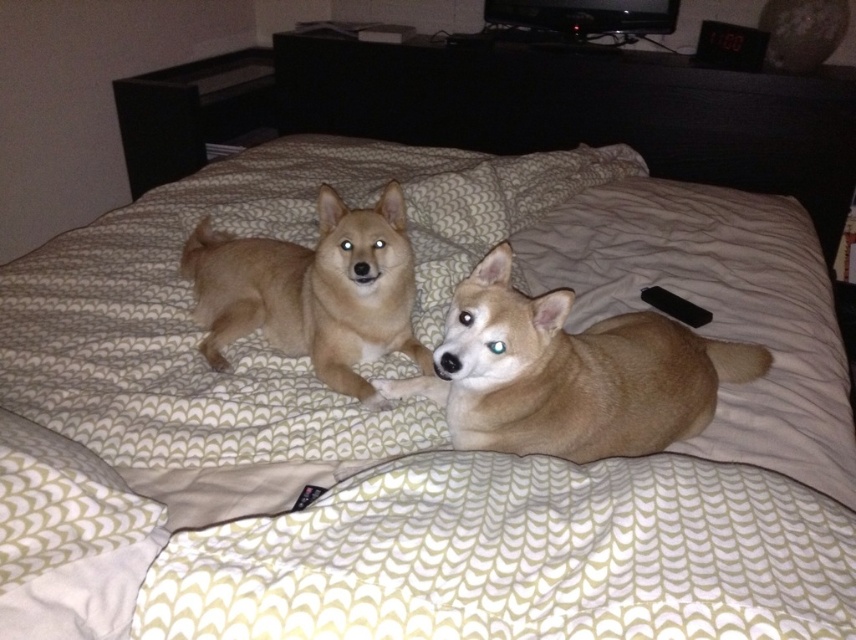
Question: Among these points, which one is nearest to the camera?

Choices:
 (A) (556, 353)
 (B) (373, 269)

Answer: (A)

Question: Can you confirm if fuzzy beige dog at center is positioned below sandy fur dog at center?

Choices:
 (A) yes
 (B) no

Answer: (A)

Question: Can you confirm if fuzzy beige dog at center is smaller than sandy fur dog at center?

Choices:
 (A) yes
 (B) no

Answer: (A)

Question: Is fuzzy beige dog at center positioned behind sandy fur dog at center?

Choices:
 (A) no
 (B) yes

Answer: (A)